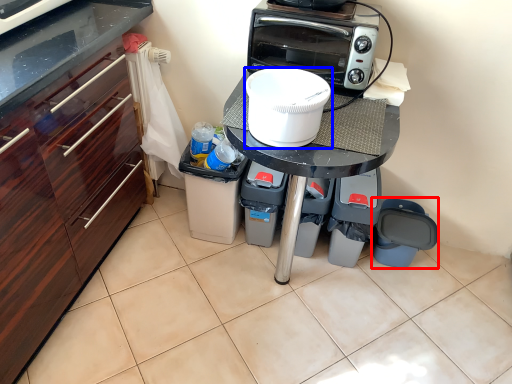
Question: Which of the following is the farthest to the observer, appliance (highlighted by a red box) or home appliance (highlighted by a blue box)?

Choices:
 (A) appliance
 (B) home appliance

Answer: (A)